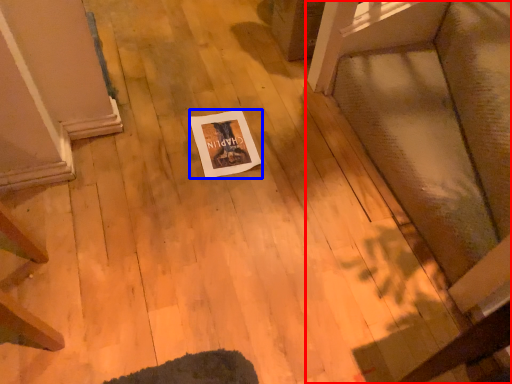
Question: Among these objects, which one is farthest to the camera, furniture (highlighted by a red box) or postcard (highlighted by a blue box)?

Choices:
 (A) furniture
 (B) postcard

Answer: (B)